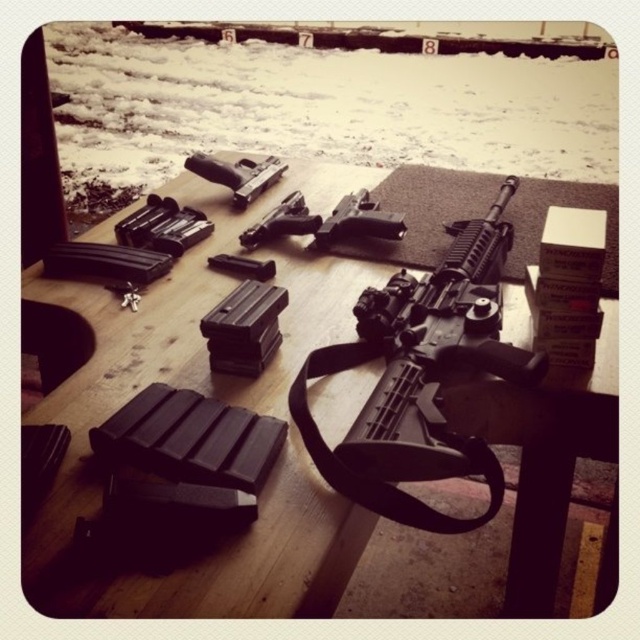
You are a photographer setting up a shoot at the shooting range. You need to position a light source to illuminate both the black matte picnic table at center and the matte black handgun at center. Based on their positions, where should you place the light source relative to the objects to ensure both are well lit?

The black matte picnic table at center is located below the matte black handgun at center. To ensure both are well lit, position the light source above the handgun so that light can reach both the handgun and the table below it.

You are organizing a shooting event and need to ensure all equipment fits on the table. Given the black matte picnic table at center and the matte black handgun at center, which object requires more space on the table?

The black matte picnic table at center requires more space on the table as it is bigger than the matte black handgun at center.